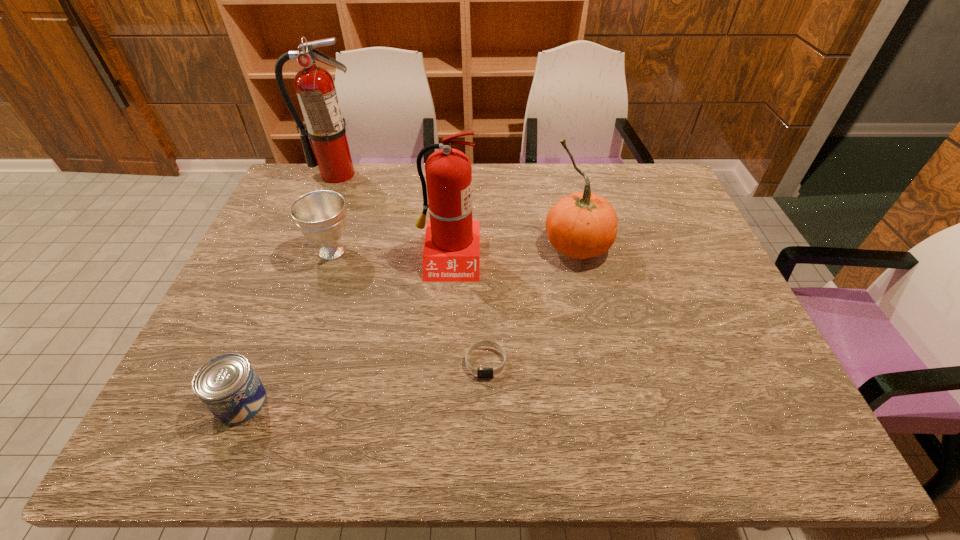
Find the location of a particular element. The image size is (960, 540). the farthest object is located at coordinates click(315, 87).

Where is `the taller fire extinguisher`? the taller fire extinguisher is located at coordinates (315, 87).

Locate an element on the screen. This screenshot has width=960, height=540. the shorter fire extinguisher is located at coordinates (451, 253).

The height and width of the screenshot is (540, 960). What are the coordinates of `the right fire extinguisher` in the screenshot? It's located at (451, 253).

You are a GUI agent. You are given a task and a screenshot of the screen. Output one action in this format:
    pyautogui.click(x=<x>, y=<y>)
    Task: Click on the fourth shortest object
    
    Given the screenshot: What is the action you would take?
    pyautogui.click(x=583, y=225)

Where is `the rightmost object`? This screenshot has width=960, height=540. the rightmost object is located at coordinates (583, 225).

This screenshot has height=540, width=960. Find the location of `the fourth tallest object`. the fourth tallest object is located at coordinates (320, 215).

What are the coordinates of `the fifth tallest object` in the screenshot? It's located at click(227, 385).

In order to click on can in this screenshot , I will do `click(227, 385)`.

This screenshot has width=960, height=540. I want to click on wristband, so click(x=480, y=372).